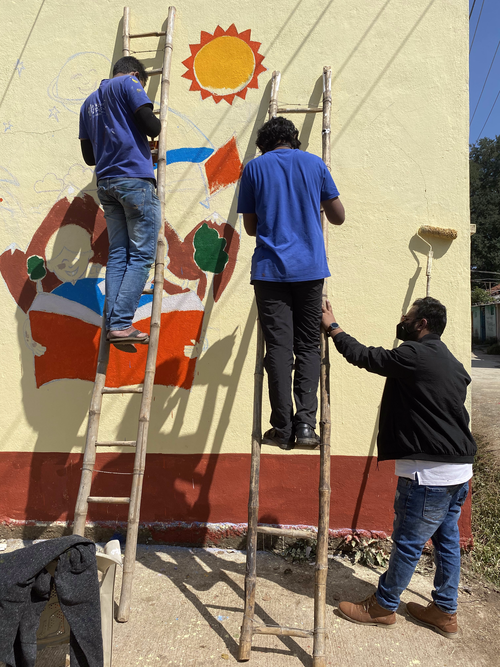
Where is `concrete wall`? This screenshot has width=500, height=667. concrete wall is located at coordinates (406, 87).